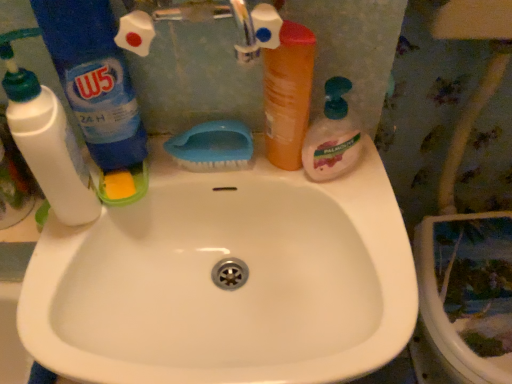
Identify the location of free spot in front of orange matte bottle at upper center. This screenshot has width=512, height=384. (339, 218).